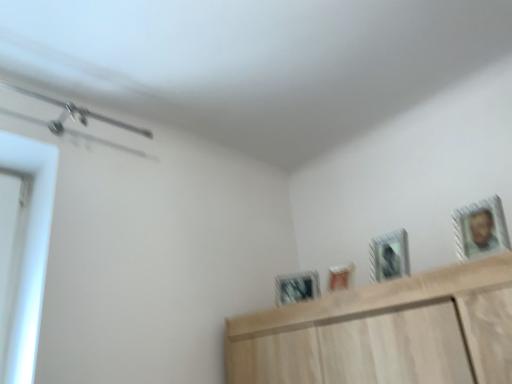
Image resolution: width=512 pixels, height=384 pixels. Describe the element at coordinates (341, 277) in the screenshot. I see `matte white picture frame at center, which is counted as the 3th picture frame, starting from the right` at that location.

Image resolution: width=512 pixels, height=384 pixels. In order to click on metallic silver picture frame at center, which ranks as the first picture frame in back-to-front order in this screenshot , I will do `click(297, 287)`.

At what (x,y) coordinates should I click in order to perform the action: click on matte white picture frame at center, the third picture frame in the front-to-back sequence. Please return your answer as a coordinate pair (x, y). This screenshot has height=384, width=512. Looking at the image, I should click on (341, 277).

Considering the positions of point (346, 275) and point (463, 207), is point (346, 275) closer or farther from the camera than point (463, 207)?

Point (346, 275) is positioned closer to the camera compared to point (463, 207).

Considering their positions, is matte white picture frame at center, the third picture frame in the front-to-back sequence, located in front of or behind metallic silver picture frame at upper right, which is counted as the first picture frame, starting from the right?

In the image, matte white picture frame at center, the third picture frame in the front-to-back sequence, appears behind metallic silver picture frame at upper right, which is counted as the first picture frame, starting from the right.

Consider the image. Is matte white picture frame at center, which is counted as the 3th picture frame, starting from the right, positioned with its back to metallic silver picture frame at upper right, the 4th picture frame from the back?

No, metallic silver picture frame at upper right, the 4th picture frame from the back, is not at the back of matte white picture frame at center, which is counted as the 3th picture frame, starting from the right.

Looking at this image, is metallic silver picture frame at center, the fourth picture frame in the front-to-back sequence, facing away from metallic silver picture frame at upper right, which is counted as the first picture frame, starting from the right?

No, metallic silver picture frame at center, the fourth picture frame in the front-to-back sequence, is not facing the opposite direction of metallic silver picture frame at upper right, which is counted as the first picture frame, starting from the right.

Does point (307, 276) appear closer or farther from the camera than point (455, 220)?

Point (307, 276) appears to be farther away from the viewer than point (455, 220).

Can you confirm if metallic silver picture frame at center, the fourth picture frame in the front-to-back sequence, is thinner than metallic silver picture frame at upper right, which appears as the 4th picture frame when viewed from the left?

No, metallic silver picture frame at center, the fourth picture frame in the front-to-back sequence, is not thinner than metallic silver picture frame at upper right, which appears as the 4th picture frame when viewed from the left.

From the picture: Considering the sizes of objects metallic silver picture frame at center, the first picture frame positioned from the left, and metallic silver picture frame at upper right, which is counted as the first picture frame, starting from the right, in the image provided, who is bigger, metallic silver picture frame at center, the first picture frame positioned from the left, or metallic silver picture frame at upper right, which is counted as the first picture frame, starting from the right,?

With larger size is metallic silver picture frame at center, the first picture frame positioned from the left.

From the image's perspective, would you say metallic silver picture frame at upper right, which appears as the 4th picture frame when viewed from the left, is shown under metallic silver picture frame at center, the first picture frame positioned from the left?

No, from the image's perspective, metallic silver picture frame at upper right, which appears as the 4th picture frame when viewed from the left, is not beneath metallic silver picture frame at center, the first picture frame positioned from the left.

Is metallic silver picture frame at upper right, which is counted as the first picture frame, starting from the right, closer to the viewer compared to metallic silver picture frame at center, the first picture frame positioned from the left?

Yes, the depth of metallic silver picture frame at upper right, which is counted as the first picture frame, starting from the right, is less than that of metallic silver picture frame at center, the first picture frame positioned from the left.

Who is shorter, metallic silver picture frame at upper right, which is counted as the 1th picture frame, starting from the front, or metallic silver picture frame at center, the fourth picture frame in the front-to-back sequence?

metallic silver picture frame at center, the fourth picture frame in the front-to-back sequence.

Is metallic silver picture frame at upper right, which is counted as the 1th picture frame, starting from the front, oriented towards metallic silver picture frame at center, which ranks as the first picture frame in back-to-front order?

No, metallic silver picture frame at upper right, which is counted as the 1th picture frame, starting from the front, is not oriented towards metallic silver picture frame at center, which ranks as the first picture frame in back-to-front order.

Identify the location of picture frame that is the 2nd one when counting downward from the metallic silver picture frame at upper right, the 4th picture frame from the back (from the image's perspective). This screenshot has width=512, height=384. (341, 277).

Does metallic silver picture frame at upper right, which appears as the 4th picture frame when viewed from the left, have a greater height compared to matte white picture frame at center, which ranks as the second picture frame in left-to-right order?

Yes.

How distant is metallic silver picture frame at upper right, which appears as the 4th picture frame when viewed from the left, from matte white picture frame at center, which ranks as the second picture frame in left-to-right order?

metallic silver picture frame at upper right, which appears as the 4th picture frame when viewed from the left, is 19.11 inches away from matte white picture frame at center, which ranks as the second picture frame in left-to-right order.

You are a GUI agent. You are given a task and a screenshot of the screen. Output one action in this format:
    pyautogui.click(x=<x>, y=<y>)
    Task: Click on the 2nd picture frame to the left when counting from the metallic silver picture frame at upper center, the 2th picture frame from the front
    This screenshot has height=384, width=512.
    Given the screenshot: What is the action you would take?
    pyautogui.click(x=297, y=287)

Is metallic silver picture frame at center, which ranks as the first picture frame in back-to-front order, situated inside metallic silver picture frame at upper center, the 2th picture frame from the front, or outside?

metallic silver picture frame at center, which ranks as the first picture frame in back-to-front order, is not inside metallic silver picture frame at upper center, the 2th picture frame from the front, it's outside.

Does point (309, 271) come behind point (394, 243)?

That is True.

From the image's perspective, which one is positioned higher, metallic silver picture frame at center, the first picture frame positioned from the left, or metallic silver picture frame at upper center, positioned as the third picture frame in left-to-right order?

metallic silver picture frame at upper center, positioned as the third picture frame in left-to-right order, appears higher in the image.

Do you think metallic silver picture frame at upper center, the 2th picture frame from the front, is within metallic silver picture frame at upper right, the 4th picture frame from the back, or outside of it?

metallic silver picture frame at upper center, the 2th picture frame from the front, exists outside the volume of metallic silver picture frame at upper right, the 4th picture frame from the back.

In the image, is metallic silver picture frame at upper center, the 2th picture frame from the front, on the left side or the right side of metallic silver picture frame at upper right, which appears as the 4th picture frame when viewed from the left?

Based on their positions, metallic silver picture frame at upper center, the 2th picture frame from the front, is located to the left of metallic silver picture frame at upper right, which appears as the 4th picture frame when viewed from the left.

Would you say metallic silver picture frame at upper center, which is counted as the 3th picture frame, starting from the back, is a long distance from metallic silver picture frame at upper right, which is counted as the 1th picture frame, starting from the front?

No, there isn't a large distance between metallic silver picture frame at upper center, which is counted as the 3th picture frame, starting from the back, and metallic silver picture frame at upper right, which is counted as the 1th picture frame, starting from the front.

Considering their positions, is metallic silver picture frame at upper center, the 2th picture frame from the front, located in front of or behind metallic silver picture frame at upper right, which appears as the 4th picture frame when viewed from the left?

In the image, metallic silver picture frame at upper center, the 2th picture frame from the front, appears behind metallic silver picture frame at upper right, which appears as the 4th picture frame when viewed from the left.

From the image's perspective, does metallic silver picture frame at center, the first picture frame positioned from the left, appear lower than matte white picture frame at center, which ranks as the second picture frame in left-to-right order?

Yes.

Is point (308, 291) closer or farther from the camera than point (329, 287)?

Point (308, 291) is positioned closer to the camera compared to point (329, 287).

Can you tell me how much metallic silver picture frame at center, which ranks as the first picture frame in back-to-front order, and matte white picture frame at center, which ranks as the second picture frame in left-to-right order, differ in facing direction?

0.0242 degrees.

Is metallic silver picture frame at center, which ranks as the first picture frame in back-to-front order, looking in the opposite direction of matte white picture frame at center, which is counted as the 3th picture frame, starting from the right?

metallic silver picture frame at center, which ranks as the first picture frame in back-to-front order, does not have its back to matte white picture frame at center, which is counted as the 3th picture frame, starting from the right.

Where is `the 2nd picture frame in front of the matte white picture frame at center, the third picture frame in the front-to-back sequence, starting your count from the anchor`? This screenshot has height=384, width=512. the 2nd picture frame in front of the matte white picture frame at center, the third picture frame in the front-to-back sequence, starting your count from the anchor is located at coordinates (480, 229).

You are a GUI agent. You are given a task and a screenshot of the screen. Output one action in this format:
    pyautogui.click(x=<x>, y=<y>)
    Task: Click on the 2nd picture frame located beneath the metallic silver picture frame at upper right, which is counted as the 1th picture frame, starting from the front (from a real-world perspective)
    
    Given the screenshot: What is the action you would take?
    pyautogui.click(x=297, y=287)

Which object lies further to the anchor point metallic silver picture frame at center, the first picture frame positioned from the left, metallic silver picture frame at upper center, the 2th picture frame from the front, or matte white picture frame at center, marked as the 2th picture frame in a back-to-front arrangement?

metallic silver picture frame at upper center, the 2th picture frame from the front, lies further to metallic silver picture frame at center, the first picture frame positioned from the left, than the other object.

From the image, which object appears to be farther from metallic silver picture frame at upper center, marked as the 2th picture frame in a right-to-left arrangement, metallic silver picture frame at center, which ranks as the first picture frame in back-to-front order, or metallic silver picture frame at upper right, which is counted as the 1th picture frame, starting from the front?

metallic silver picture frame at center, which ranks as the first picture frame in back-to-front order, is positioned further to the anchor metallic silver picture frame at upper center, marked as the 2th picture frame in a right-to-left arrangement.

From the image, which object appears to be nearer to metallic silver picture frame at upper right, which is counted as the 1th picture frame, starting from the front, matte white picture frame at center, which is counted as the 3th picture frame, starting from the right, or metallic silver picture frame at upper center, the 2th picture frame from the front?

Based on the image, metallic silver picture frame at upper center, the 2th picture frame from the front, appears to be nearer to metallic silver picture frame at upper right, which is counted as the 1th picture frame, starting from the front.

In the scene shown: Which object lies further to the anchor point metallic silver picture frame at upper center, which is counted as the 3th picture frame, starting from the back, metallic silver picture frame at center, positioned as the fourth picture frame in right-to-left order, or matte white picture frame at center, marked as the 2th picture frame in a back-to-front arrangement?

metallic silver picture frame at center, positioned as the fourth picture frame in right-to-left order, lies further to metallic silver picture frame at upper center, which is counted as the 3th picture frame, starting from the back, than the other object.

Which object lies further to the anchor point matte white picture frame at center, the third picture frame in the front-to-back sequence, metallic silver picture frame at center, which ranks as the first picture frame in back-to-front order, or metallic silver picture frame at upper right, which appears as the 4th picture frame when viewed from the left?

Based on the image, metallic silver picture frame at upper right, which appears as the 4th picture frame when viewed from the left, appears to be further to matte white picture frame at center, the third picture frame in the front-to-back sequence.

Looking at the image, which one is located closer to metallic silver picture frame at upper right, which is counted as the first picture frame, starting from the right, metallic silver picture frame at upper center, the 2th picture frame from the front, or matte white picture frame at center, the third picture frame in the front-to-back sequence?

metallic silver picture frame at upper center, the 2th picture frame from the front.

When comparing their distances from metallic silver picture frame at upper right, which is counted as the 1th picture frame, starting from the front, does metallic silver picture frame at center, the first picture frame positioned from the left, or metallic silver picture frame at upper center, marked as the 2th picture frame in a right-to-left arrangement, seem closer?

The object closer to metallic silver picture frame at upper right, which is counted as the 1th picture frame, starting from the front, is metallic silver picture frame at upper center, marked as the 2th picture frame in a right-to-left arrangement.

Considering their positions, is metallic silver picture frame at upper center, positioned as the third picture frame in left-to-right order, positioned further to metallic silver picture frame at center, which ranks as the first picture frame in back-to-front order, than metallic silver picture frame at upper right, the 4th picture frame from the back?

Among the two, metallic silver picture frame at upper right, the 4th picture frame from the back, is located further to metallic silver picture frame at center, which ranks as the first picture frame in back-to-front order.

Locate an element on the screen. This screenshot has width=512, height=384. picture frame located between metallic silver picture frame at upper right, which appears as the 4th picture frame when viewed from the left, and matte white picture frame at center, the third picture frame in the front-to-back sequence, in the depth direction is located at coordinates (389, 256).

This screenshot has width=512, height=384. What are the coordinates of `picture frame between metallic silver picture frame at center, which ranks as the first picture frame in back-to-front order, and metallic silver picture frame at upper center, which is counted as the 3th picture frame, starting from the back, from left to right` in the screenshot? It's located at (341, 277).